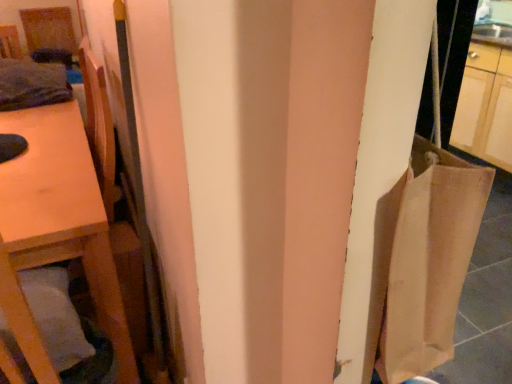
Question: Can you confirm if wooden chair at left is bigger than white soft pillow at lower left?

Choices:
 (A) no
 (B) yes

Answer: (A)

Question: Can you confirm if wooden chair at left is wider than white soft pillow at lower left?

Choices:
 (A) yes
 (B) no

Answer: (B)

Question: Is wooden chair at left not inside white soft pillow at lower left?

Choices:
 (A) yes
 (B) no

Answer: (A)

Question: Is wooden chair at left at the right side of white soft pillow at lower left?

Choices:
 (A) no
 (B) yes

Answer: (B)

Question: Is wooden chair at left positioned before white soft pillow at lower left?

Choices:
 (A) yes
 (B) no

Answer: (B)

Question: Would you consider wooden chair at left to be distant from white soft pillow at lower left?

Choices:
 (A) yes
 (B) no

Answer: (B)

Question: Can you confirm if wooden chair at left is taller than wooden table at left?

Choices:
 (A) yes
 (B) no

Answer: (A)

Question: Does wooden chair at left turn towards wooden table at left?

Choices:
 (A) no
 (B) yes

Answer: (B)

Question: Are wooden chair at left and wooden table at left making contact?

Choices:
 (A) no
 (B) yes

Answer: (A)

Question: Is wooden chair at left oriented away from wooden table at left?

Choices:
 (A) yes
 (B) no

Answer: (B)

Question: From a real-world perspective, is wooden chair at left under wooden table at left?

Choices:
 (A) no
 (B) yes

Answer: (A)

Question: Considering the relative positions of wooden chair at left and wooden table at left in the image provided, is wooden chair at left in front of wooden table at left?

Choices:
 (A) yes
 (B) no

Answer: (A)

Question: Is wooden table at left turned away from white soft pillow at lower left?

Choices:
 (A) yes
 (B) no

Answer: (B)